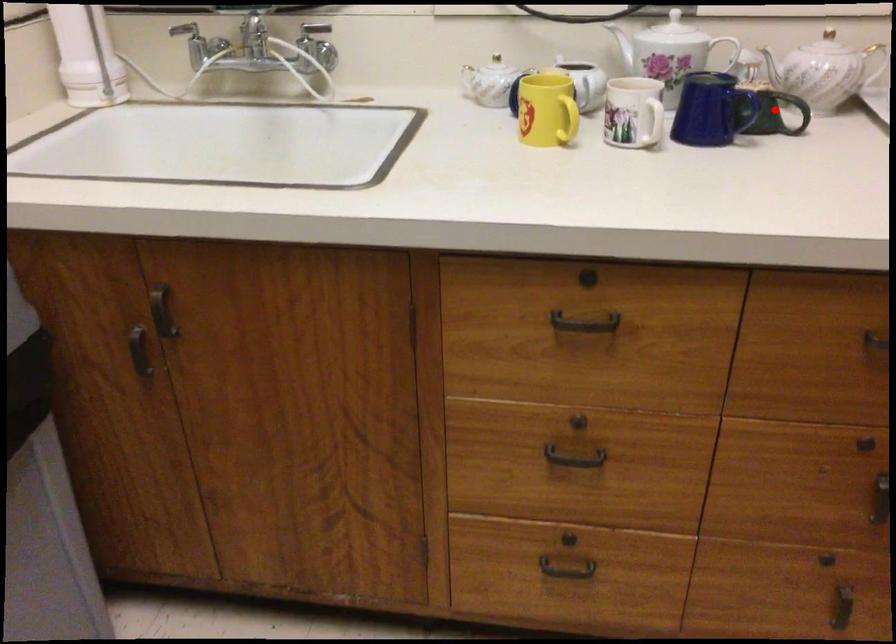
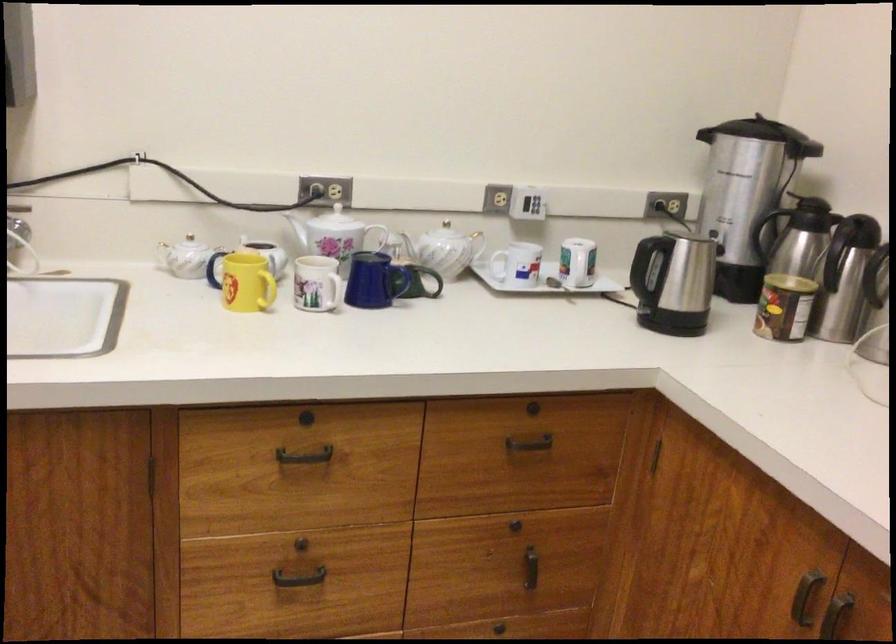
Locate, in the second image, the point that corresponds to the highlighted location in the first image.

(420, 281)